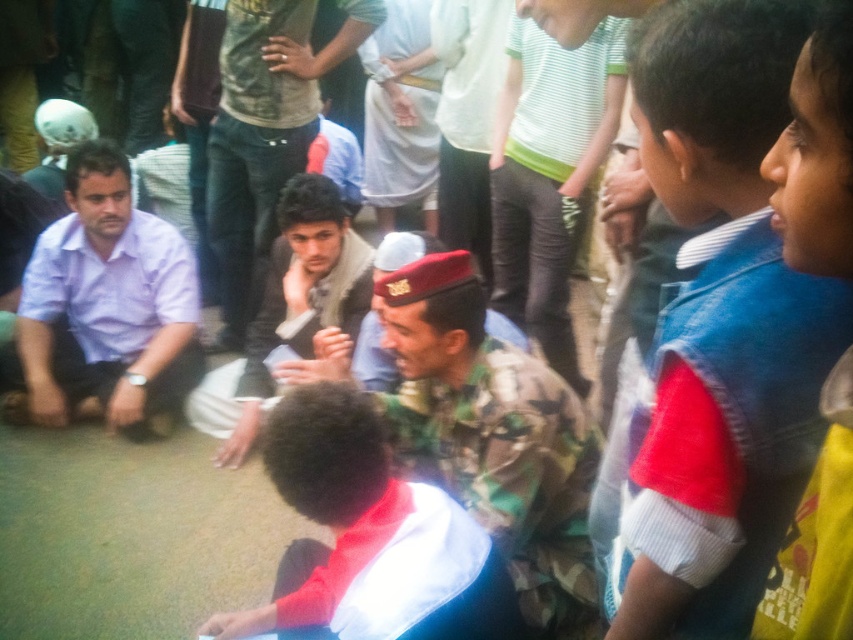
Who is higher up, blue denim vest at right or white fabric shirt at center?

blue denim vest at right is above.

Consider the image. Is blue denim vest at right closer to the viewer compared to white fabric shirt at center?

Yes.

Identify the location of blue denim vest at right. The image size is (853, 640). [720, 330].

Is matte purple shirt at left taller than camouflage uniform at center?

Yes.

Who is higher up, matte purple shirt at left or camouflage uniform at center?

matte purple shirt at left is higher up.

Does point (36, 257) come behind point (271, 348)?

No, (36, 257) is in front of (271, 348).

Where is `matte purple shirt at left`? The image size is (853, 640). matte purple shirt at left is located at coordinates (107, 304).

Which of these two, blue denim vest at right or camouflage uniform at center, stands shorter?

Result: Standing shorter between the two is blue denim vest at right.

How much distance is there between blue denim vest at right and camouflage uniform at center?

blue denim vest at right is 1.93 meters from camouflage uniform at center.

This screenshot has height=640, width=853. What are the coordinates of `blue denim vest at right` in the screenshot? It's located at (720, 330).